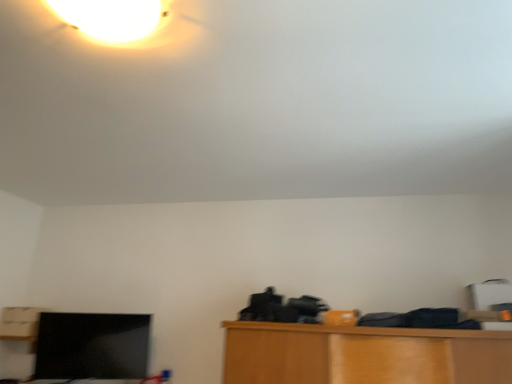
What is the approximate width of matte wood cabinet at lower left?

It is 8.14 inches.

This screenshot has width=512, height=384. Describe the element at coordinates (19, 323) in the screenshot. I see `matte wood cabinet at lower left` at that location.

Where is `matte wood cabinet at lower left`? matte wood cabinet at lower left is located at coordinates (19, 323).

Locate an element on the screen. matte wood cabinet at lower left is located at coordinates (19, 323).